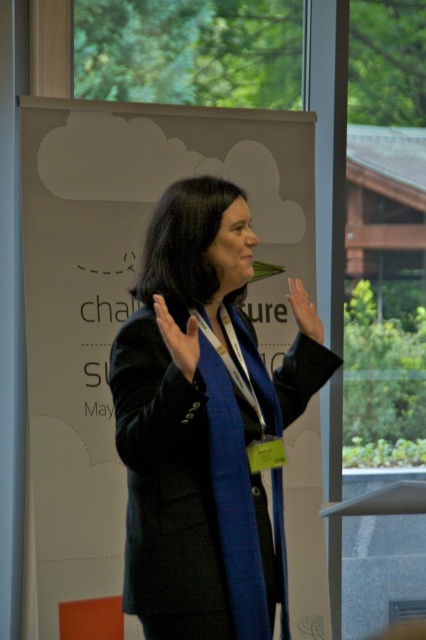
You are designing a virtual reality setup and need to place a holographic microphone exactly at the same position as the black woolen blazer at center. What coordinates should you input into the system?

The coordinates for the black woolen blazer at center are at point (204, 429), so you should input those coordinates into the system to place the holographic microphone.

You are an event photographer trying to capture a candid shot of the speaker. You notice the black woolen blazer at center and the matte black hand at upper center. Which object is closer to the camera?

The matte black hand at upper center is closer to the camera because it is positioned above the black woolen blazer at center.